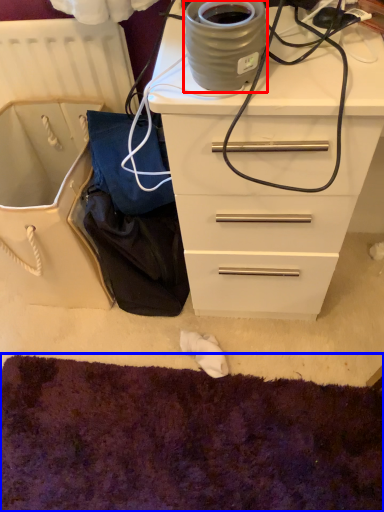
Question: Which of the following is the closest to the observer, appliance (highlighted by a red box) or cat bed (highlighted by a blue box)?

Choices:
 (A) appliance
 (B) cat bed

Answer: (A)